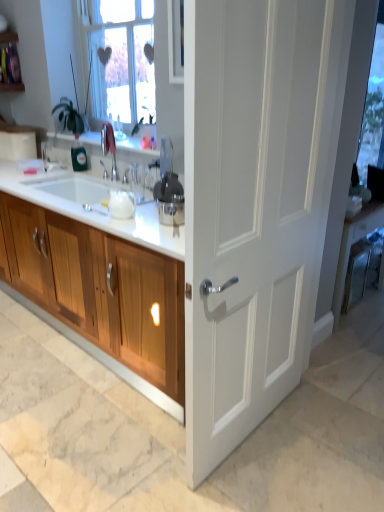
You are a GUI agent. You are given a task and a screenshot of the screen. Output one action in this format:
    pyautogui.click(x=<x>, y=<y>)
    Task: Click on the free space in front of white matte door at center
    
    Given the screenshot: What is the action you would take?
    pyautogui.click(x=266, y=478)